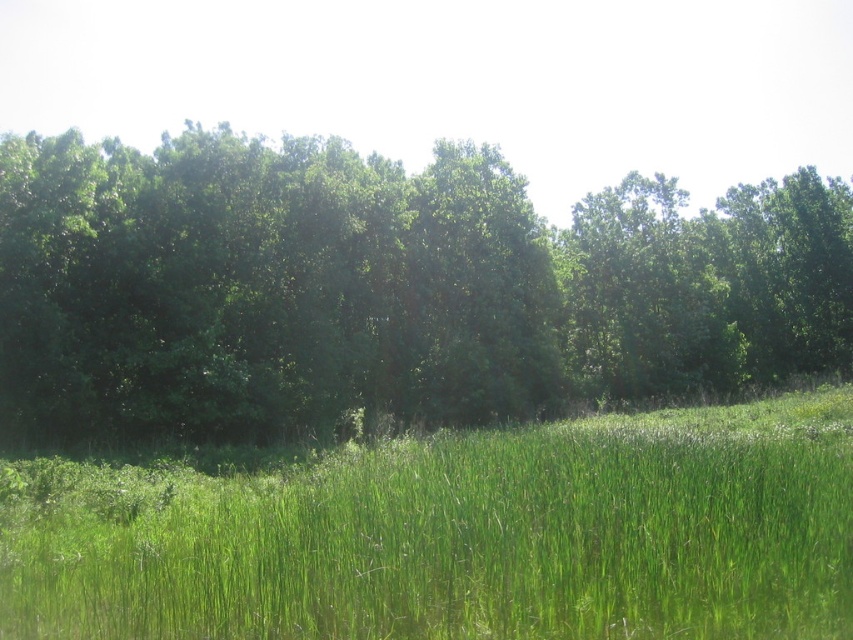
The image size is (853, 640). Describe the element at coordinates (386, 288) in the screenshot. I see `green leafy trees at center` at that location.

Does point (91, 224) lie in front of point (74, 632)?

No, it is not.

I want to click on green leafy trees at center, so click(386, 288).